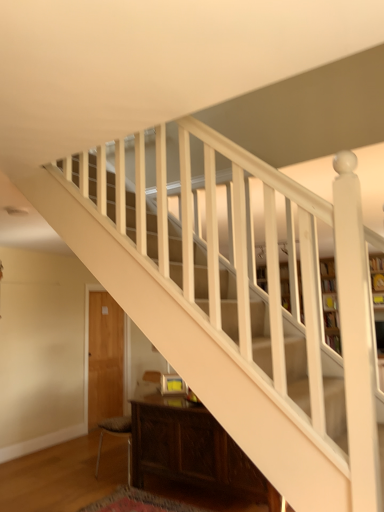
Question: Is dark brown leather armchair at lower left taller or shorter than white wood bookcase at center?

Choices:
 (A) short
 (B) tall

Answer: (A)

Question: Considering the positions of point (144, 373) and point (332, 284), is point (144, 373) closer or farther from the camera than point (332, 284)?

Choices:
 (A) closer
 (B) farther

Answer: (B)

Question: Which of these objects is positioned closest to the dark wood cabinet at lower center?

Choices:
 (A) dark brown leather armchair at lower left
 (B) white wood bookcase at center

Answer: (A)

Question: Which is nearer to the white wood bookcase at center?

Choices:
 (A) dark brown leather armchair at lower left
 (B) dark wood cabinet at lower center

Answer: (B)